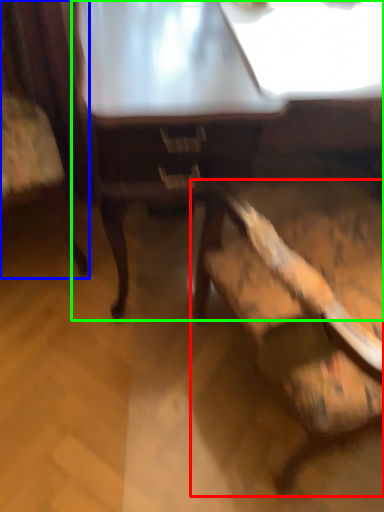
Question: Based on their relative distances, which object is farther from chair (highlighted by a red box)? Choose from chair (highlighted by a blue box) and table (highlighted by a green box).

Choices:
 (A) chair
 (B) table

Answer: (A)